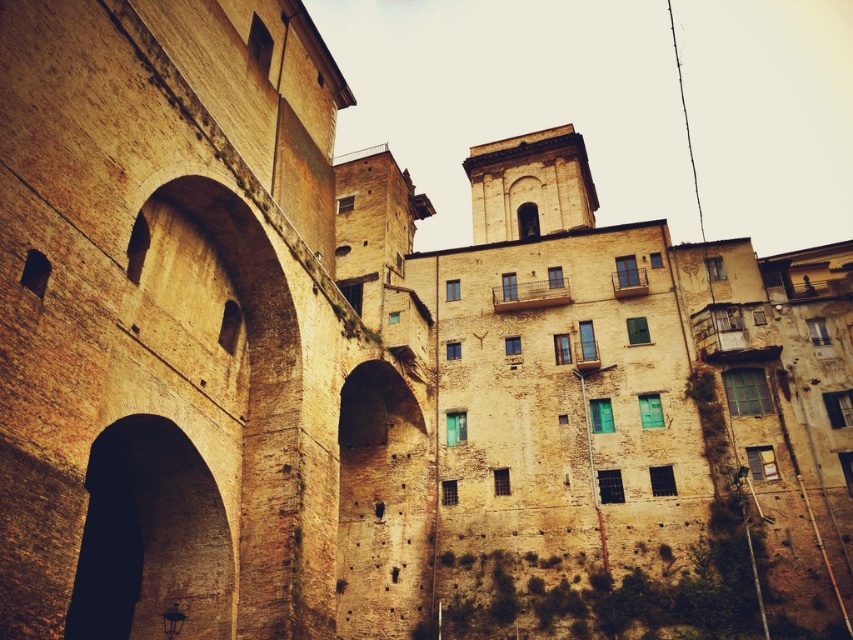
Find the location of `dark stone archway at lower left`. dark stone archway at lower left is located at coordinates (149, 538).

Who is taller, dark stone archway at lower left or brown rough stone archway at center?

Standing taller between the two is brown rough stone archway at center.

Does point (173, 582) lie in front of point (376, 435)?

Yes, it is in front of point (376, 435).

Locate an element on the screen. The height and width of the screenshot is (640, 853). dark stone archway at lower left is located at coordinates (149, 538).